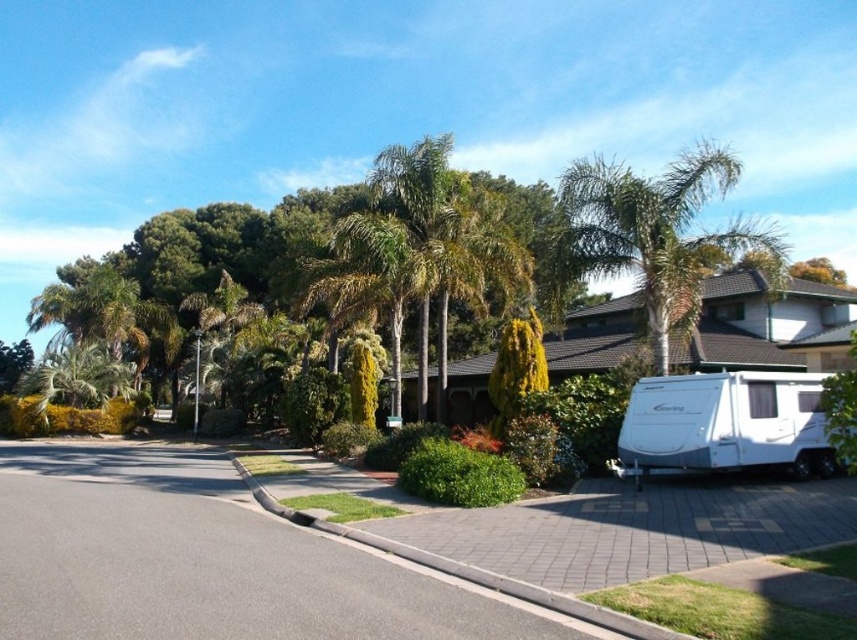
Question: Can you confirm if green leafy palm tree at center is bigger than green leafy palm tree at upper center?

Choices:
 (A) no
 (B) yes

Answer: (A)

Question: Does green leafy palm tree at center appear on the left side of white glossy caravan at lower right?

Choices:
 (A) no
 (B) yes

Answer: (B)

Question: From the image, what is the correct spatial relationship of green leafy palm tree at center in relation to white glossy caravan at lower right?

Choices:
 (A) left
 (B) right

Answer: (A)

Question: Which of these objects is positioned farthest from the green leafy palm tree at center?

Choices:
 (A) green leafy palm tree at upper center
 (B) white glossy caravan at lower right

Answer: (A)

Question: Which object is farther from the camera taking this photo?

Choices:
 (A) green leafy palm tree at upper center
 (B) white glossy caravan at lower right

Answer: (A)

Question: Considering the real-world distances, which object is closest to the green leafy palm tree at upper center?

Choices:
 (A) green leafy palm tree at center
 (B) white glossy caravan at lower right

Answer: (B)